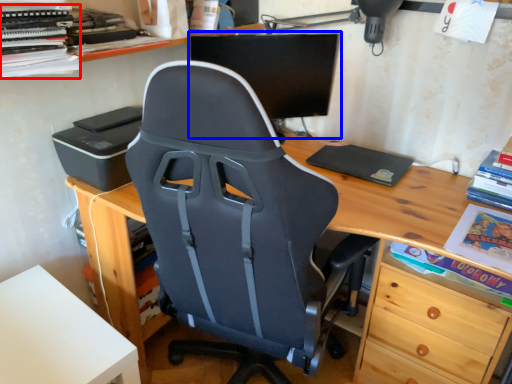
Question: Which object is further to the camera taking this photo, book (highlighted by a red box) or computer monitor (highlighted by a blue box)?

Choices:
 (A) book
 (B) computer monitor

Answer: (B)